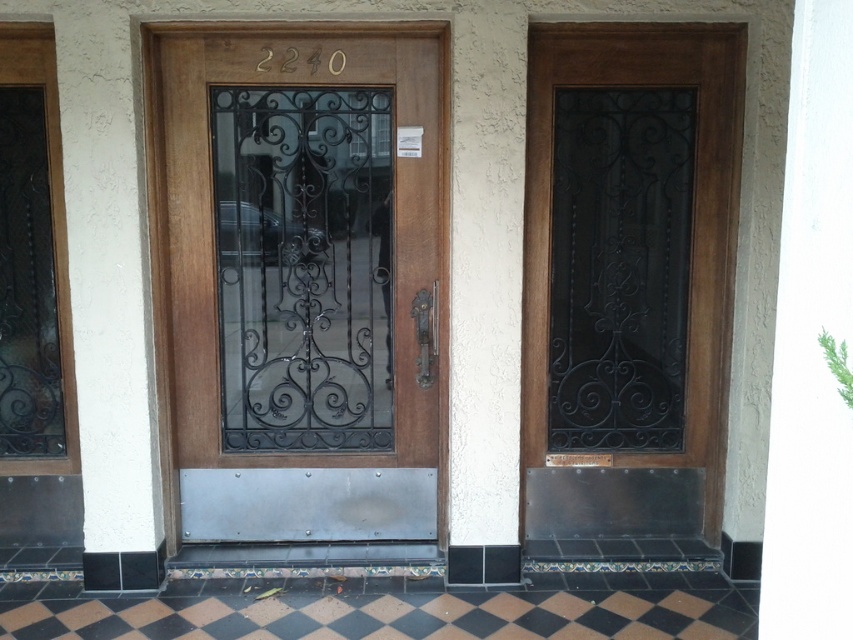
Question: Does matte wood door at center have a smaller size compared to black wrought iron glass door at center?

Choices:
 (A) no
 (B) yes

Answer: (A)

Question: Can you confirm if matte wood door at center is bigger than black wrought iron glass door at center?

Choices:
 (A) no
 (B) yes

Answer: (B)

Question: Can you confirm if matte wood door at center is positioned below black wrought iron glass door at center?

Choices:
 (A) no
 (B) yes

Answer: (B)

Question: Which object appears closest to the camera in this image?

Choices:
 (A) matte wood door at center
 (B) black wrought iron glass door at center

Answer: (A)

Question: Which of the following is the closest to the observer?

Choices:
 (A) 292,412
 (B) 421,56

Answer: (B)